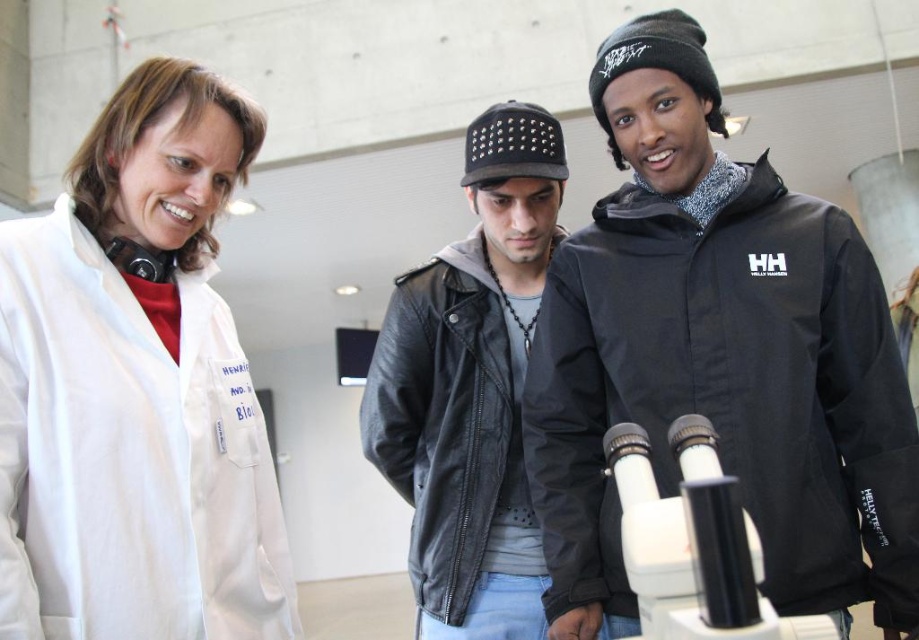
Does black leather jacket at center have a lesser width compared to white plastic microscope at center?

No, black leather jacket at center is not thinner than white plastic microscope at center.

Is black leather jacket at center below white plastic microscope at center?

Indeed, black leather jacket at center is positioned under white plastic microscope at center.

Does point (440, 358) lie in front of point (672, 557)?

No, (440, 358) is behind (672, 557).

Where is `black leather jacket at center`? black leather jacket at center is located at coordinates (454, 428).

Does white lab coat at upper left have a greater width compared to black leather jacket at center?

No, white lab coat at upper left is not wider than black leather jacket at center.

You are a GUI agent. You are given a task and a screenshot of the screen. Output one action in this format:
    pyautogui.click(x=<x>, y=<y>)
    Task: Click on the white lab coat at upper left
    The height and width of the screenshot is (640, 919).
    Given the screenshot: What is the action you would take?
    pyautogui.click(x=135, y=388)

Does black waterproof jacket at center have a greater width compared to black leather jacket at center?

Yes.

Does black waterproof jacket at center appear under black leather jacket at center?

No.

Describe the element at coordinates (728, 392) in the screenshot. I see `black waterproof jacket at center` at that location.

Find the location of a particular element. The image size is (919, 640). black waterproof jacket at center is located at coordinates (728, 392).